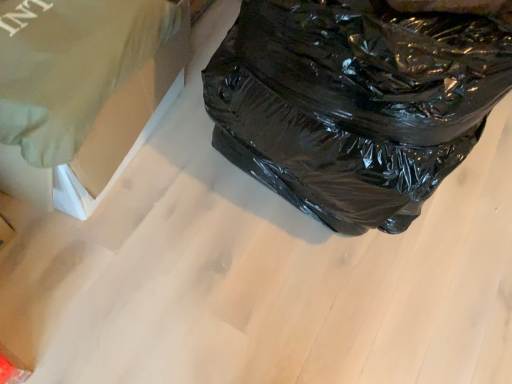
Question: Considering the positions of point (121, 130) and point (355, 29), is point (121, 130) closer or farther from the camera than point (355, 29)?

Choices:
 (A) farther
 (B) closer

Answer: (A)

Question: From the image's perspective, relative to black plastic bag at right, is green fabric at upper left above or below?

Choices:
 (A) above
 (B) below

Answer: (B)

Question: From a real-world perspective, is green fabric at upper left above or below black plastic bag at right?

Choices:
 (A) below
 (B) above

Answer: (A)

Question: In terms of height, does black plastic bag at right look taller or shorter compared to green fabric at upper left?

Choices:
 (A) tall
 (B) short

Answer: (A)

Question: From the image's perspective, relative to green fabric at upper left, is black plastic bag at right above or below?

Choices:
 (A) above
 (B) below

Answer: (A)

Question: Is point (288, 28) positioned closer to the camera than point (72, 92)?

Choices:
 (A) farther
 (B) closer

Answer: (B)

Question: From a real-world perspective, relative to green fabric at upper left, is black plastic bag at right vertically above or below?

Choices:
 (A) above
 (B) below

Answer: (A)